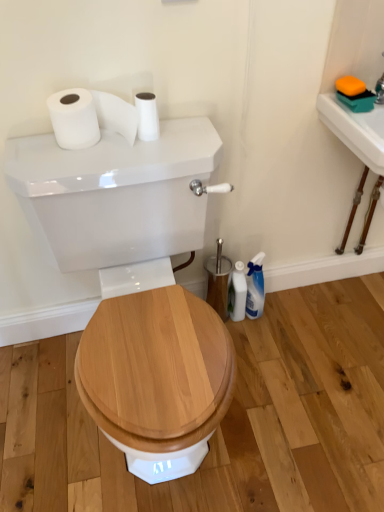
What are the coordinates of `free space to the left of white matte toilet paper at upper center, the first toilet paper positioned from the right` in the screenshot? It's located at (80, 150).